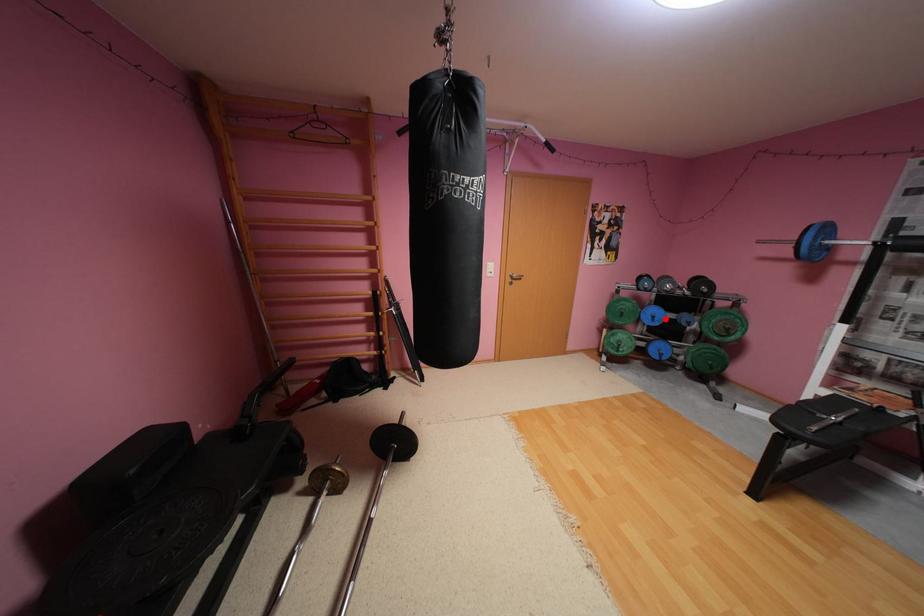
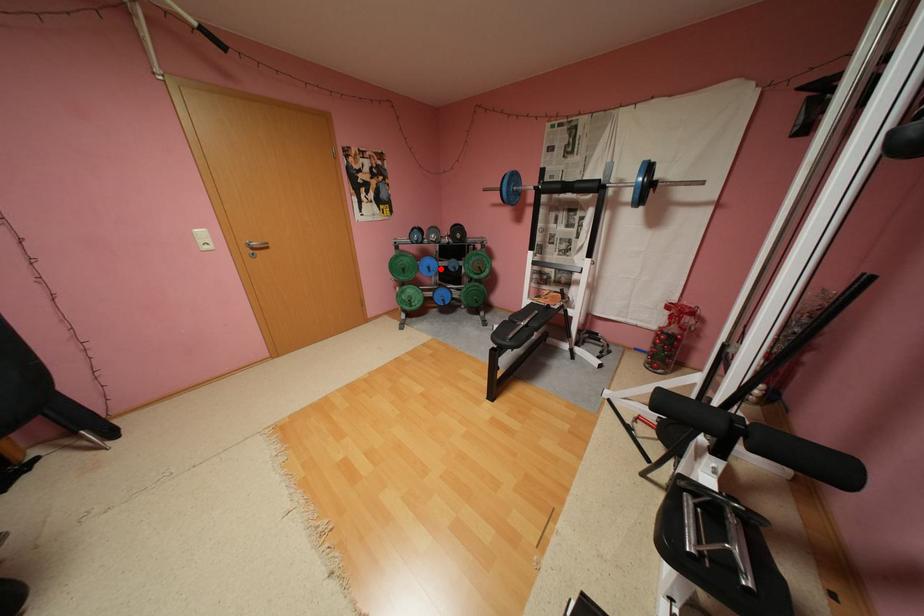
In the scene shown: I am providing you with two images of the same scene from different viewpoints. A red point is marked on the first image and another point is marked on the second image. Is the marked point in image1 the same physical position as the marked point in image2?

Yes